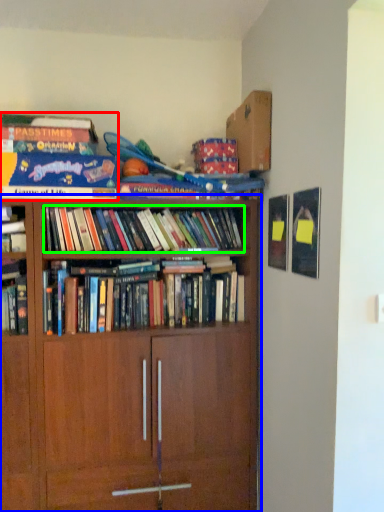
Question: Which object is positioned farthest from book (highlighted by a red box)? Select from bookcase (highlighted by a blue box) and book (highlighted by a green box).

Choices:
 (A) bookcase
 (B) book

Answer: (A)